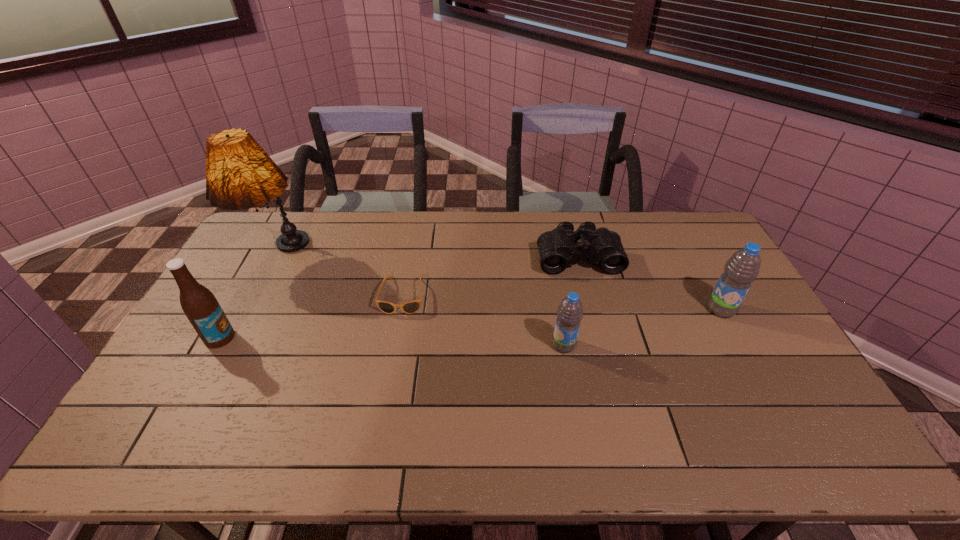
I want to click on empty location between the nearer water bottle and the beer bottle, so click(x=392, y=341).

Locate an element on the screen. the third closest object to the beer bottle is located at coordinates (570, 311).

Select which object appears as the fifth closest to the lampshade. Please provide its 2D coordinates. Your answer should be formatted as a tuple, i.e. [(x, y)], where the tuple contains the x and y coordinates of a point satisfying the conditions above.

[(742, 268)]

Where is `blank area in the image that satisfies the following two spatial constraints: 1. on the front-facing side of the fourth shortest object; 2. on the right side of the shortest object`? This screenshot has width=960, height=540. blank area in the image that satisfies the following two spatial constraints: 1. on the front-facing side of the fourth shortest object; 2. on the right side of the shortest object is located at coordinates (400, 309).

Locate an element on the screen. The height and width of the screenshot is (540, 960). vacant space that satisfies the following two spatial constraints: 1. on the front-facing side of the lampshade; 2. on the left side of the right water bottle is located at coordinates (252, 309).

Locate an element on the screen. Image resolution: width=960 pixels, height=540 pixels. free space that satisfies the following two spatial constraints: 1. on the front-facing side of the tallest object; 2. on the left side of the fourth shortest object is located at coordinates (252, 309).

You are a GUI agent. You are given a task and a screenshot of the screen. Output one action in this format:
    pyautogui.click(x=<x>, y=<y>)
    Task: Click on the vacant space that satisfies the following two spatial constraints: 1. on the back side of the beer bottle; 2. on the right side of the rightmost object
    
    Given the screenshot: What is the action you would take?
    pyautogui.click(x=236, y=309)

Find the location of a particular element. Image resolution: width=960 pixels, height=540 pixels. blank area in the image that satisfies the following two spatial constraints: 1. on the front-facing side of the right water bottle; 2. on the left side of the lampshade is located at coordinates 252,309.